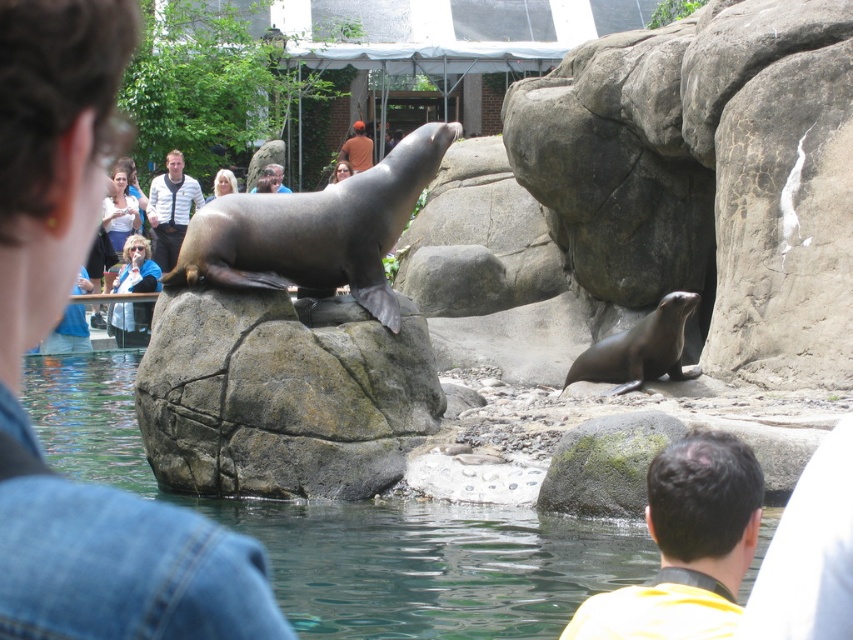
Question: Among these objects, which one is farthest from the camera?

Choices:
 (A) yellow fabric at center
 (B) clear water at lower center
 (C) striped shirt at center
 (D) gray rough rock at center

Answer: (C)

Question: Can you confirm if clear water at lower center is positioned below yellow fabric at center?

Choices:
 (A) yes
 (B) no

Answer: (A)

Question: Is gray rough rock at center further to camera compared to clear water at lower center?

Choices:
 (A) yes
 (B) no

Answer: (A)

Question: Which of the following is the farthest from the observer?

Choices:
 (A) transparent glass pool at center
 (B) brown leather jacket at upper center
 (C) gray rough rock at center

Answer: (B)

Question: Among these objects, which one is nearest to the camera?

Choices:
 (A) gray rough rock at center
 (B) brown leather jacket at upper center

Answer: (A)

Question: Does clear water at lower center have a smaller size compared to yellow fabric at center?

Choices:
 (A) yes
 (B) no

Answer: (B)